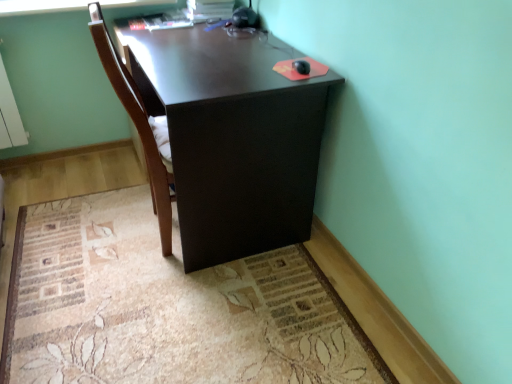
The image size is (512, 384). I want to click on vacant space in brown wood chair at center (from a real-world perspective), so (150, 239).